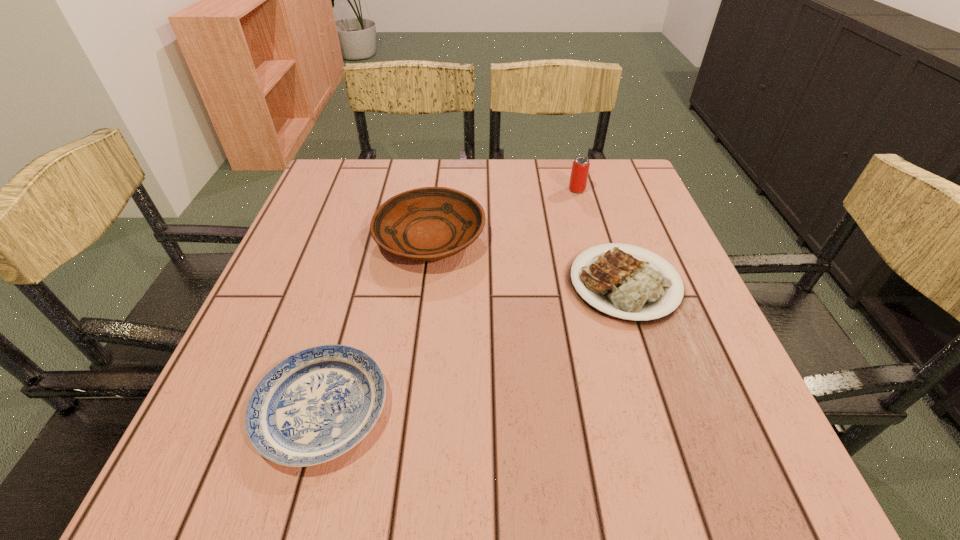
This screenshot has height=540, width=960. I want to click on plate positioned at the far edge, so click(x=430, y=223).

This screenshot has height=540, width=960. I want to click on object at the near edge, so click(317, 404).

You are a GUI agent. You are given a task and a screenshot of the screen. Output one action in this format:
    pyautogui.click(x=<x>, y=<y>)
    Task: Click on the object that is positioned at the left edge
    The image size is (960, 540).
    Given the screenshot: What is the action you would take?
    pyautogui.click(x=317, y=404)

Find the location of a particular element. Image resolution: width=960 pixels, height=540 pixels. beer can located in the right edge section of the desktop is located at coordinates (580, 169).

Find the location of `plate that is at the right edge`. plate that is at the right edge is located at coordinates (620, 285).

What are the coordinates of `object that is at the near left corner` in the screenshot? It's located at (317, 404).

Identify the location of object present at the far right corner. The width and height of the screenshot is (960, 540). (580, 169).

I want to click on free location at the far edge of the desktop, so coord(555,192).

In the image, there is a desktop. Find the location of `vacant space at the near edge`. vacant space at the near edge is located at coordinates coord(531,456).

In the image, there is a desktop. Where is `vacant space at the left edge`? vacant space at the left edge is located at coordinates (355, 258).